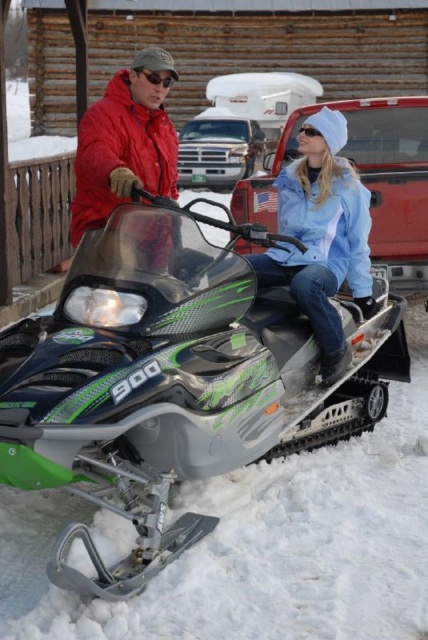
Is point (165, 120) behind point (309, 136)?

That is False.

Can you confirm if matte red jacket at upper left is wider than clear plastic goggles at upper center?

Indeed, matte red jacket at upper left has a greater width compared to clear plastic goggles at upper center.

Locate an element on the screen. matte red jacket at upper left is located at coordinates (124, 145).

Who is higher up, light blue denim jacket at center or clear plastic goggles at upper center?

clear plastic goggles at upper center

Does light blue denim jacket at center have a larger size compared to clear plastic goggles at upper center?

Yes.

Does point (366, 273) come in front of point (303, 128)?

No, (366, 273) is behind (303, 128).

I want to click on light blue denim jacket at center, so click(x=321, y=237).

Is point (94, 358) closer to camera compared to point (312, 129)?

Yes.

The image size is (428, 640). What do you see at coordinates (174, 380) in the screenshot? I see `green matte snowmobile at center` at bounding box center [174, 380].

Locate an element on the screen. The image size is (428, 640). green matte snowmobile at center is located at coordinates (174, 380).